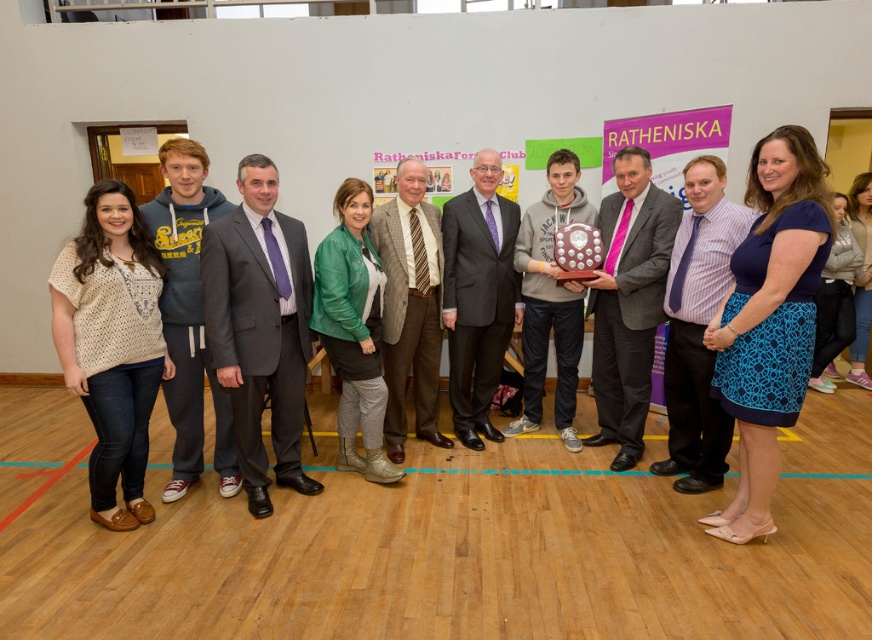
Question: Does matte gray suit at center lie behind matte silver trophy at center?

Choices:
 (A) yes
 (B) no

Answer: (B)

Question: Does matte gray suit at center come behind dark gray suit at center?

Choices:
 (A) no
 (B) yes

Answer: (A)

Question: Which of the following is the farthest from the observer?

Choices:
 (A) (234, 316)
 (B) (488, 237)

Answer: (B)

Question: Estimate the real-world distances between objects in this image. Which object is farther from the dark gray suit at center?

Choices:
 (A) matte gray suit at center
 (B) matte silver trophy at center
 (C) brown textured blazer at center

Answer: (A)

Question: Among these objects, which one is nearest to the camera?

Choices:
 (A) matte silver trophy at center
 (B) brown textured blazer at center
 (C) matte gray suit at center

Answer: (C)

Question: Considering the relative positions of dark gray suit at center and brown textured blazer at center in the image provided, where is dark gray suit at center located with respect to brown textured blazer at center?

Choices:
 (A) above
 (B) below

Answer: (A)